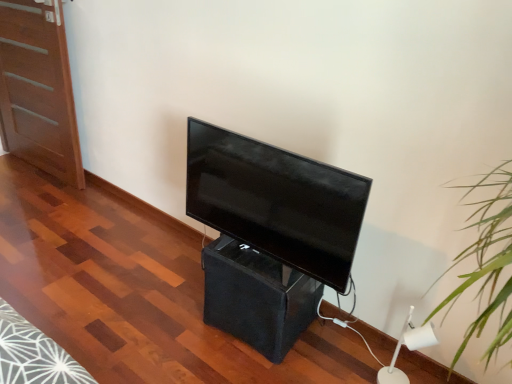
The width and height of the screenshot is (512, 384). Identify the location of vacant area to the left of white plastic lamp at lower right. (349, 363).